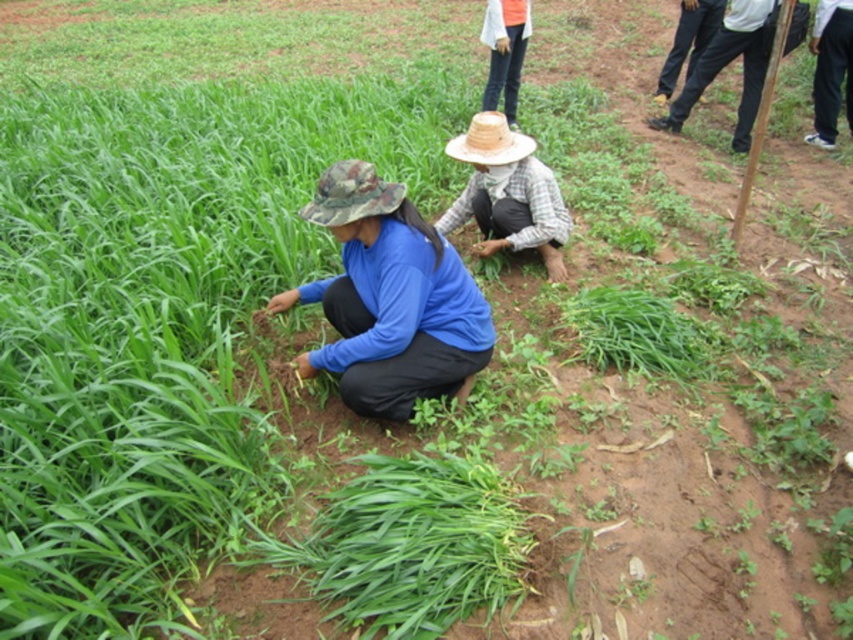
In the scene shown: You are a drone operator trying to capture a photo of the blue matte shirt at center and dark gray pants at right. From the drone camera view, which object is positioned lower in the frame?

The blue matte shirt at center is positioned lower in the frame than the dark gray pants at right because the description states that the blue matte shirt at center is below dark gray pants at right.

You are a drone operator trying to locate the blue matte shirt at center in a rural farming scene. The drone has a camera with a 100mm lens. The scene has two people working in the field. Where would you direct the drone to focus?

The blue matte shirt at center is located at point coordinates of (x=389, y=298), so the drone should focus on that coordinate to capture the blue matte shirt at center.

You are a farmer who needs to choose a hat to protect yourself from the sun. The camo fabric hat at lower left and the woven straw hat at center are available. Which hat has a wider brim?

The woven straw hat at center has a wider brim than the camo fabric hat at lower left.